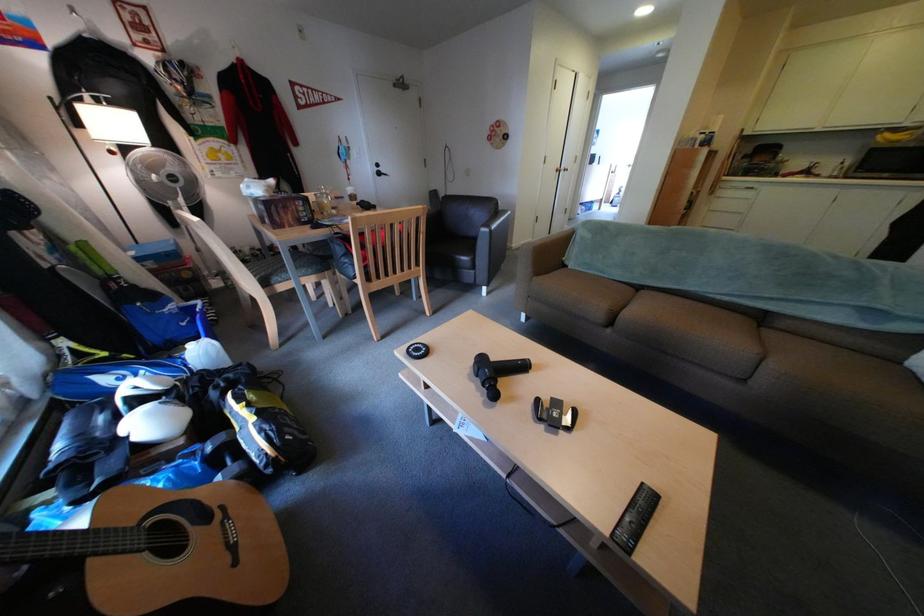
Identify the location of yellow banana. This screenshot has height=616, width=924. (x=898, y=136).